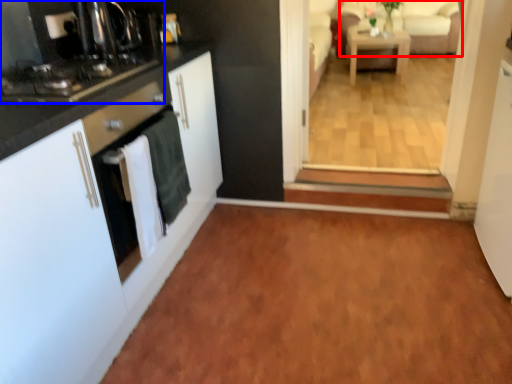
Question: Which object is further to the camera taking this photo, couch (highlighted by a red box) or home appliance (highlighted by a blue box)?

Choices:
 (A) couch
 (B) home appliance

Answer: (A)